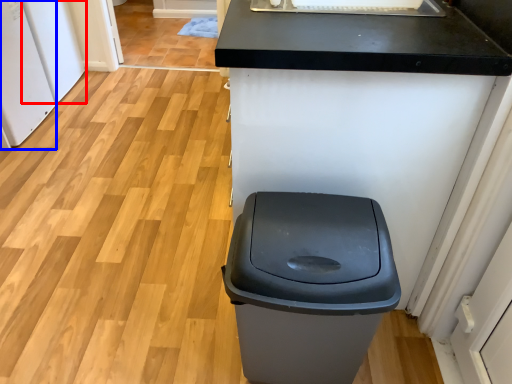
Question: Among these objects, which one is farthest to the camera, appliance (highlighted by a red box) or appliance (highlighted by a blue box)?

Choices:
 (A) appliance
 (B) appliance

Answer: (A)